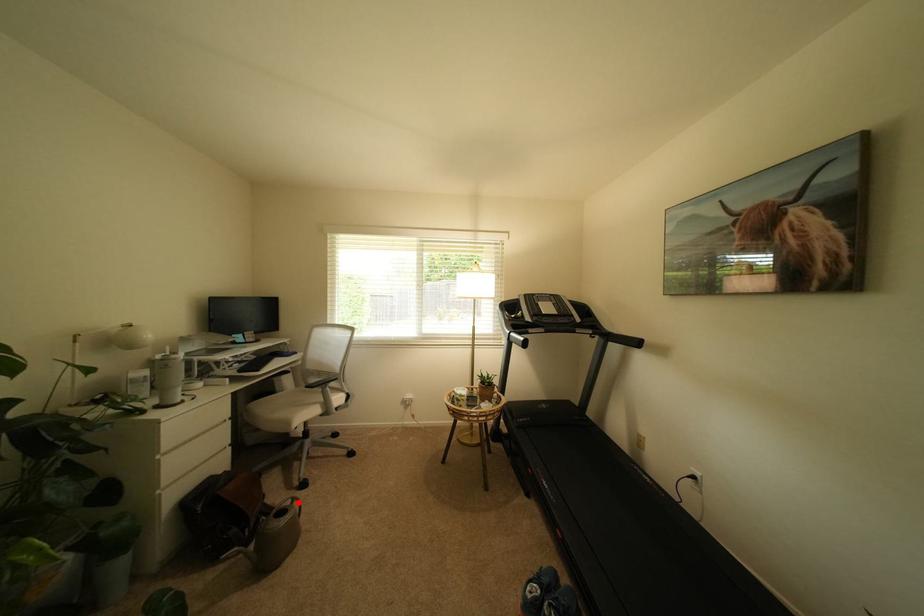
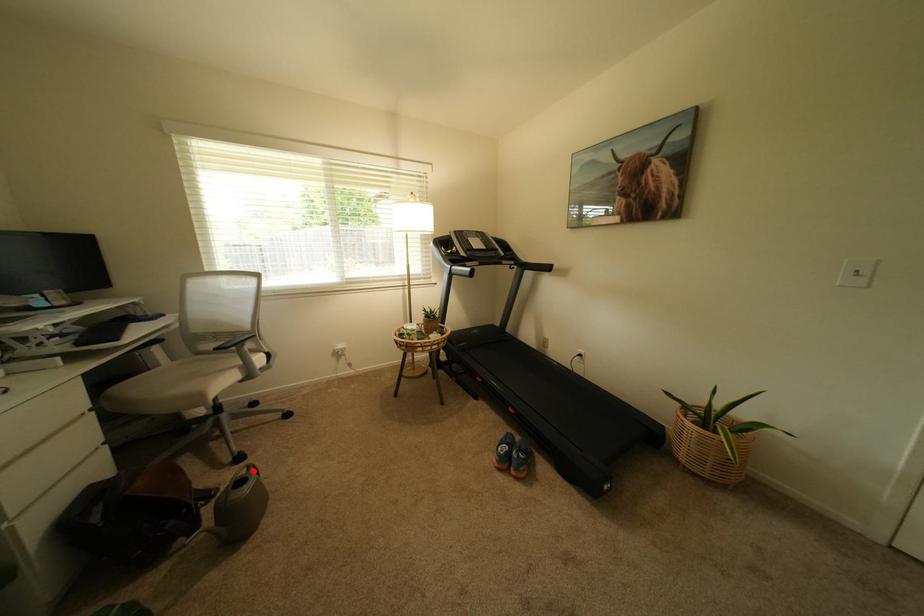
I am providing you with two images of the same scene from different viewpoints. A red point is marked on the first image and another point is marked on the second image. Do the highlighted points in image1 and image2 indicate the same real-world spot?

Yes